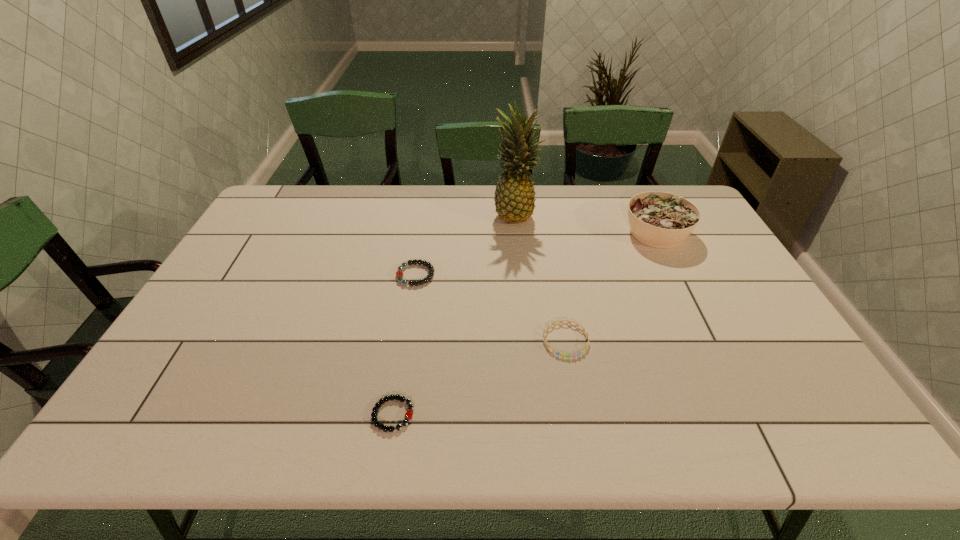
You are a GUI agent. You are given a task and a screenshot of the screen. Output one action in this format:
    pyautogui.click(x=<x>, y=<y>)
    Task: Click on the vacant space located on the surface of the rightmost bracelet showing star-shaped elements
    This screenshot has height=540, width=960.
    Given the screenshot: What is the action you would take?
    pyautogui.click(x=579, y=410)

The width and height of the screenshot is (960, 540). What are the coordinates of `vacant region located on the back of the nearest bracelet` in the screenshot? It's located at (407, 327).

The width and height of the screenshot is (960, 540). Find the location of `pineapple that is at the far edge`. pineapple that is at the far edge is located at coordinates (514, 198).

The width and height of the screenshot is (960, 540). Identify the location of salad positioned at the far edge. (662, 220).

This screenshot has width=960, height=540. Identify the location of object present at the near edge. tap(408, 415).

Find the location of a particular element. object that is at the right edge is located at coordinates (662, 220).

I want to click on object at the far right corner, so pyautogui.click(x=662, y=220).

Find the location of a particular element. The width and height of the screenshot is (960, 540). vacant space at the far edge of the desktop is located at coordinates (440, 194).

At what (x,y) coordinates should I click in order to perform the action: click on vacant area at the near edge of the desktop. Please return your answer as a coordinate pair (x, y). Looking at the image, I should click on (521, 421).

This screenshot has height=540, width=960. Find the location of `vacant space at the left edge of the desktop`. vacant space at the left edge of the desktop is located at coordinates (285, 240).